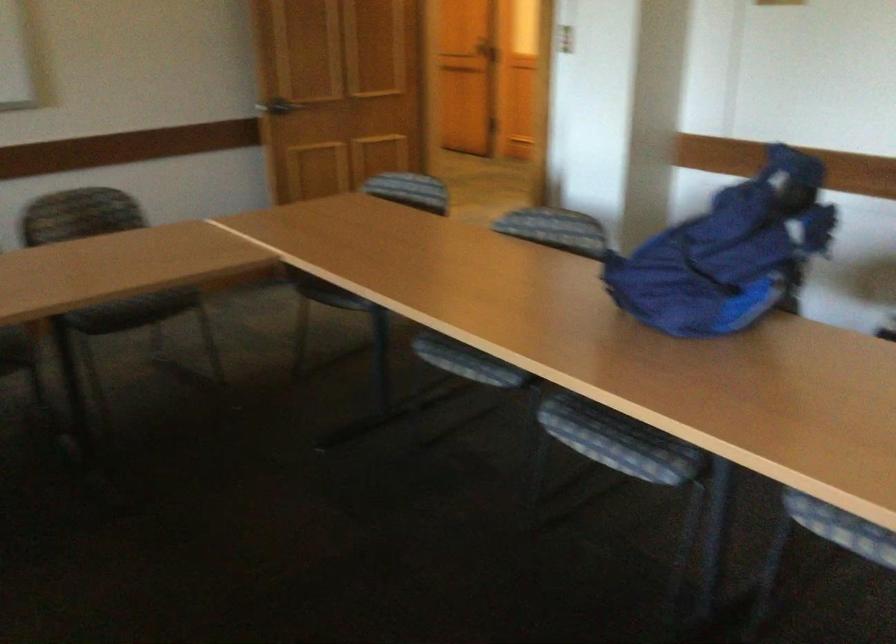
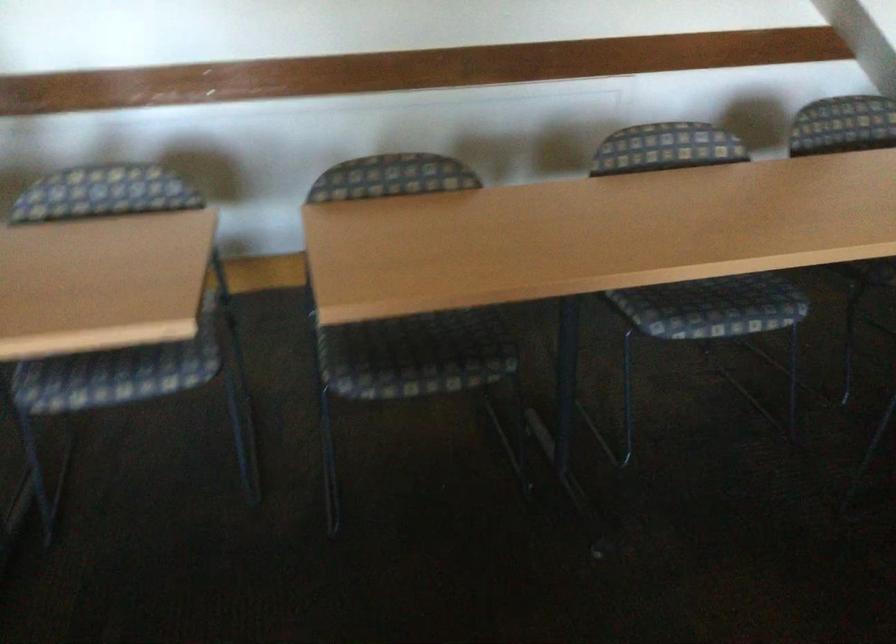
Question: The first image is from the beginning of the video and the second image is from the end. How did the camera likely rotate when shooting the video?

Choices:
 (A) Left
 (B) Right
 (C) Up
 (D) Down

Answer: (B)